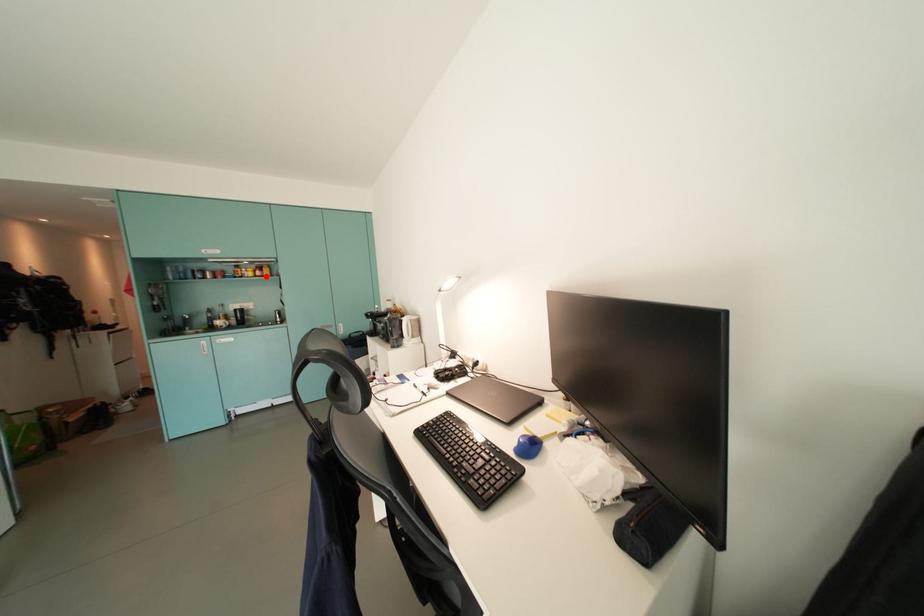
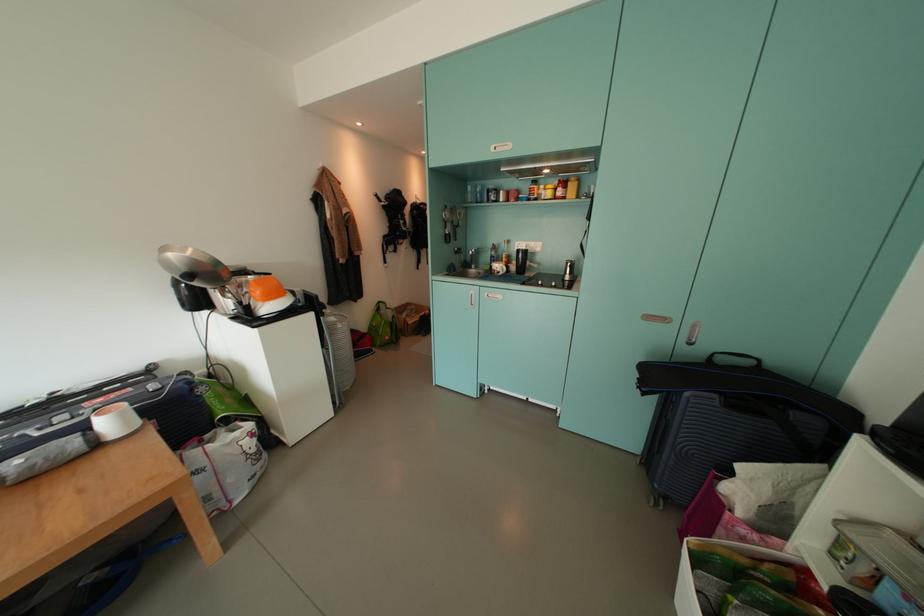
Question: I am providing you with two images of the same scene from different viewpoints. A red point is marked on the first image. At the location where the point appears in image 1, is it still visible in image 2?

Choices:
 (A) Yes
 (B) No

Answer: (A)